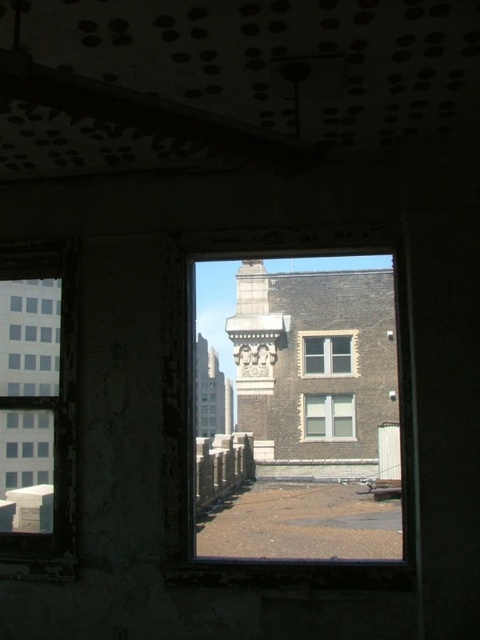
You are an interior designer assessing the room. You notice the brown stone building at center and the clear glass window at center. Which object is closer to you from your vantage point inside the room?

The brown stone building at center is positioned over the clear glass window at center, meaning it is closer to you inside the room.

You are standing inside the room looking out the window. You see the brown stone building at center and the clear glass window at left. Which object is closer to the ceiling in the room?

The clear glass window at left is closer to the ceiling in the room because the brown stone building at center is located below it.